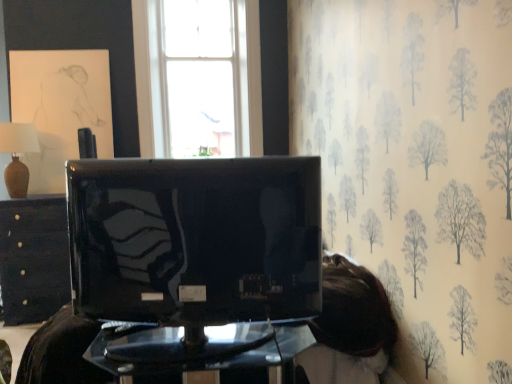
Locate an element on the screen. black glossy drawer at left, the second furniture viewed from the front is located at coordinates (33, 258).

The height and width of the screenshot is (384, 512). Describe the element at coordinates (33, 258) in the screenshot. I see `black glossy drawer at left, which is the 1th furniture from left to right` at that location.

In order to face matte black television at center, should I rotate leftwards or rightwards?

Rotate left and turn 9.198 degrees.

What are the coordinates of `matte beige vase at left` in the screenshot? It's located at (17, 155).

Is matte beige vase at left bigger than black glossy drawer at left, marked as the second furniture in a right-to-left arrangement?

No, matte beige vase at left is not bigger than black glossy drawer at left, marked as the second furniture in a right-to-left arrangement.

Does matte beige vase at left turn towards black glossy drawer at left, the second furniture viewed from the front?

No, matte beige vase at left is not facing towards black glossy drawer at left, the second furniture viewed from the front.

Is black glossy drawer at left, placed as the 1th furniture when sorted from back to front, inside matte beige vase at left?

No, black glossy drawer at left, placed as the 1th furniture when sorted from back to front, is not inside matte beige vase at left.

Between matte black television at center and matte beige vase at left, which one has more height?

Standing taller between the two is matte black television at center.

Is matte black television at center in contact with matte beige vase at left?

matte black television at center is not next to matte beige vase at left, and they're not touching.

Is matte black television at center looking in the opposite direction of matte beige vase at left?

No, matte beige vase at left is not at the back of matte black television at center.

Between matte black television at center and matte beige vase at left, which one is positioned in front?

matte black television at center is closer to the camera.

Is the surface of black glossy drawer at left, the second furniture viewed from the front, in direct contact with matte beige vase at left?

No, black glossy drawer at left, the second furniture viewed from the front, is not in contact with matte beige vase at left.

Which is behind, black glossy drawer at left, placed as the 1th furniture when sorted from back to front, or matte beige vase at left?

black glossy drawer at left, placed as the 1th furniture when sorted from back to front, is behind.

Where is `table lamp to the left of black glossy drawer at left, placed as the 1th furniture when sorted from back to front`? table lamp to the left of black glossy drawer at left, placed as the 1th furniture when sorted from back to front is located at coordinates (17, 155).

Is black glossy drawer at left, placed as the 1th furniture when sorted from back to front, not inside matte beige vase at left?

Yes, black glossy drawer at left, placed as the 1th furniture when sorted from back to front, is not within matte beige vase at left.

I want to click on table lamp behind the transparent glass table at center, marked as the 2th furniture in a left-to-right arrangement, so click(17, 155).

From the image's perspective, is transparent glass table at center, marked as the 2th furniture in a left-to-right arrangement, beneath matte beige vase at left?

Yes, from the image's perspective, transparent glass table at center, marked as the 2th furniture in a left-to-right arrangement, is beneath matte beige vase at left.

Considering the relative positions of transparent glass table at center, which is the 2th furniture in back-to-front order, and matte beige vase at left in the image provided, is transparent glass table at center, which is the 2th furniture in back-to-front order, in front of matte beige vase at left?

Yes, transparent glass table at center, which is the 2th furniture in back-to-front order, is in front of matte beige vase at left.

Is point (291, 375) in front of point (15, 138)?

Yes, point (291, 375) is closer to viewer.

Is transparent glass table at center, the first furniture from the right, facing towards matte black television at center?

No.

Which is more to the left, transparent glass table at center, marked as the 2th furniture in a left-to-right arrangement, or matte black television at center?

matte black television at center is more to the left.

Looking at this image, does transparent glass table at center, which is the 1th furniture in front-to-back order, have a smaller size compared to matte black television at center?

Yes, transparent glass table at center, which is the 1th furniture in front-to-back order, is smaller than matte black television at center.

Which of these two, transparent glass table at center, the first furniture from the right, or black glossy drawer at left, the second furniture viewed from the front, is wider?

With larger width is black glossy drawer at left, the second furniture viewed from the front.

Can you tell me how much transparent glass table at center, which is the 1th furniture in front-to-back order, and black glossy drawer at left, which is the 1th furniture from left to right, differ in facing direction?

transparent glass table at center, which is the 1th furniture in front-to-back order, and black glossy drawer at left, which is the 1th furniture from left to right, are facing 2e-05 degrees away from each other.

Is transparent glass table at center, which is the 2th furniture in back-to-front order, completely or partially outside of black glossy drawer at left, the second furniture viewed from the front?

Yes.

From a real-world perspective, is transparent glass table at center, which is the 2th furniture in back-to-front order, under black glossy drawer at left, placed as the 1th furniture when sorted from back to front?

Yes, from a real-world perspective, transparent glass table at center, which is the 2th furniture in back-to-front order, is beneath black glossy drawer at left, placed as the 1th furniture when sorted from back to front.

Is matte black television at center oriented away from transparent glass table at center, which is the 2th furniture in back-to-front order?

No, matte black television at center is not facing the opposite direction of transparent glass table at center, which is the 2th furniture in back-to-front order.

Considering the sizes of objects matte black television at center and transparent glass table at center, the first furniture from the right, in the image provided, who is taller, matte black television at center or transparent glass table at center, the first furniture from the right,?

matte black television at center is taller.

What are the coordinates of `table lamp above the black glossy drawer at left, the second furniture viewed from the front (from the image's perspective)` in the screenshot? It's located at (17, 155).

Where is `table lamp on the left of the matte black television at center`? Image resolution: width=512 pixels, height=384 pixels. table lamp on the left of the matte black television at center is located at coordinates (17, 155).

Based on their spatial positions, is transparent glass table at center, the first furniture from the right, or matte beige vase at left further from black glossy drawer at left, placed as the 1th furniture when sorted from back to front?

The object further to black glossy drawer at left, placed as the 1th furniture when sorted from back to front, is transparent glass table at center, the first furniture from the right.

Looking at the image, which one is located further to matte beige vase at left, black glossy drawer at left, marked as the second furniture in a right-to-left arrangement, or matte black television at center?

The object further to matte beige vase at left is matte black television at center.

Estimate the real-world distances between objects in this image. Which object is closer to transparent glass table at center, the first furniture from the right, matte beige vase at left or black glossy drawer at left, which is the 1th furniture from left to right?

black glossy drawer at left, which is the 1th furniture from left to right, is positioned closer to the anchor transparent glass table at center, the first furniture from the right.

Considering their positions, is matte beige vase at left positioned closer to transparent glass table at center, which is the 1th furniture in front-to-back order, than matte black television at center?

matte black television at center is closer to transparent glass table at center, which is the 1th furniture in front-to-back order.

Which object lies further to the anchor point transparent glass table at center, which is the 2th furniture in back-to-front order, black glossy drawer at left, marked as the second furniture in a right-to-left arrangement, or matte black television at center?

black glossy drawer at left, marked as the second furniture in a right-to-left arrangement, is positioned further to the anchor transparent glass table at center, which is the 2th furniture in back-to-front order.

Considering their positions, is matte black television at center positioned closer to matte beige vase at left than transparent glass table at center, marked as the 2th furniture in a left-to-right arrangement?

The object closer to matte beige vase at left is matte black television at center.

Estimate the real-world distances between objects in this image. Which object is closer to matte black television at center, matte beige vase at left or black glossy drawer at left, the second furniture viewed from the front?

black glossy drawer at left, the second furniture viewed from the front, is positioned closer to the anchor matte black television at center.

Based on their spatial positions, is black glossy drawer at left, placed as the 1th furniture when sorted from back to front, or transparent glass table at center, the first furniture from the right, further from matte beige vase at left?

transparent glass table at center, the first furniture from the right, is further to matte beige vase at left.

Identify the location of furniture located between matte black television at center and black glossy drawer at left, which is the 1th furniture from left to right, in the depth direction. (202, 359).

The image size is (512, 384). In order to click on furniture between matte black television at center and matte beige vase at left in the front-back direction in this screenshot , I will do `click(202, 359)`.

Where is `table lamp between transparent glass table at center, marked as the 2th furniture in a left-to-right arrangement, and black glossy drawer at left, the second furniture viewed from the front, in the front-back direction`? table lamp between transparent glass table at center, marked as the 2th furniture in a left-to-right arrangement, and black glossy drawer at left, the second furniture viewed from the front, in the front-back direction is located at coordinates (17, 155).

Where is `table lamp between matte black television at center and black glossy drawer at left, the second furniture viewed from the front, from front to back`? Image resolution: width=512 pixels, height=384 pixels. table lamp between matte black television at center and black glossy drawer at left, the second furniture viewed from the front, from front to back is located at coordinates (17, 155).